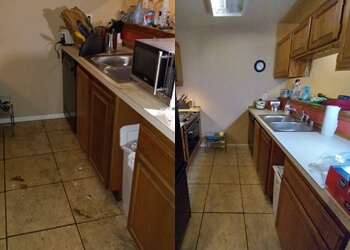
Locate an element on the screen. knife block is located at coordinates (182, 104).